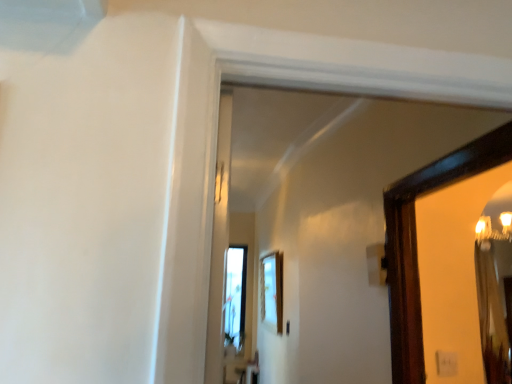
Question: Should I look upward or downward to see wooden mirror at right?

Choices:
 (A) down
 (B) up

Answer: (A)